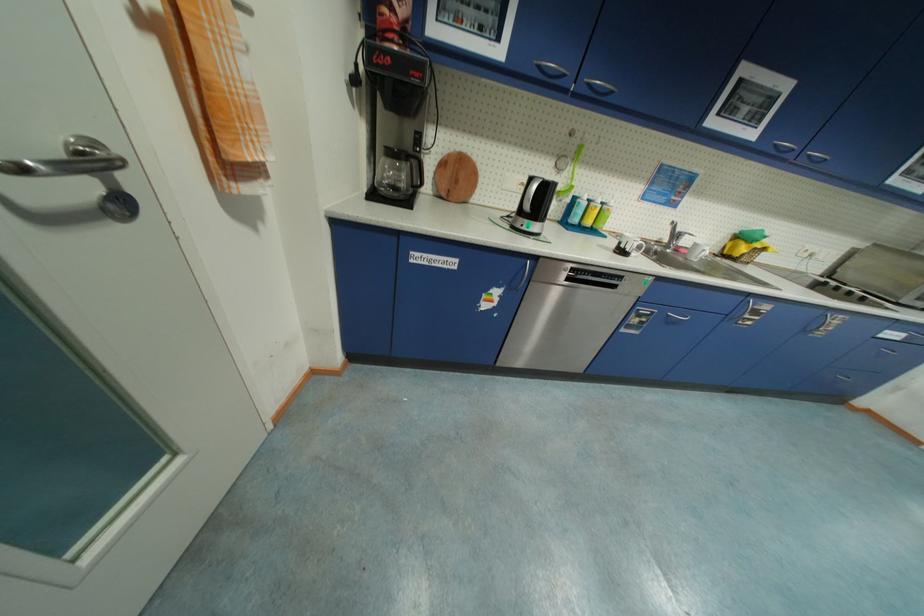
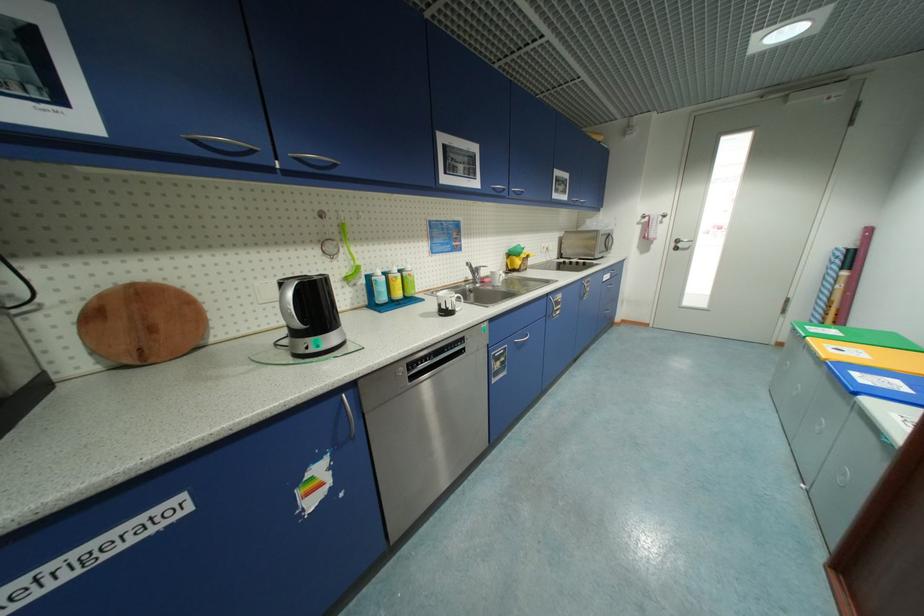
Locate, in the second image, the point that corresponds to point 633,251 in the first image.

(456, 310)